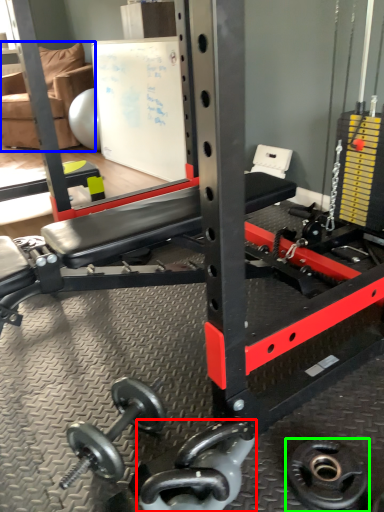
Question: Which is nearer to the dumbbell (highlighted by a red box)? chair (highlighted by a blue box) or wheel (highlighted by a green box).

Choices:
 (A) chair
 (B) wheel

Answer: (B)